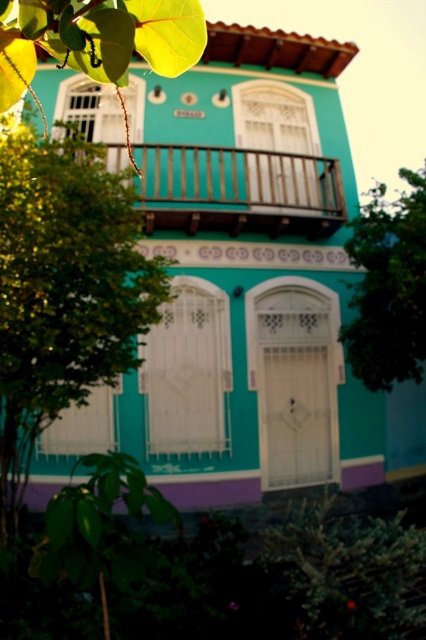
Does wooden at upper center have a larger size compared to green leafy tree at upper right?

Correct, wooden at upper center is larger in size than green leafy tree at upper right.

Does point (252, 166) come farther from viewer compared to point (354, 317)?

Yes, point (252, 166) is behind point (354, 317).

Between point (328, 225) and point (420, 211), which one is positioned in front?

Point (420, 211) is in front.

Where is `wooden at upper center`? The height and width of the screenshot is (640, 426). wooden at upper center is located at coordinates (238, 189).

Is green leafy tree at left closer to camera compared to green leafy tree at lower left?

No, it is not.

Can you confirm if green leafy tree at left is positioned to the left of green leafy tree at lower left?

Correct, you'll find green leafy tree at left to the left of green leafy tree at lower left.

Is point (20, 406) behind point (124, 477)?

That is False.

Locate an element on the screen. green leafy tree at left is located at coordinates (63, 291).

Looking at this image, which is more to the left, green leafy tree at upper right or green leafy tree at lower left?

Positioned to the left is green leafy tree at lower left.

Consider the image. Does green leafy tree at upper right have a larger size compared to green leafy tree at lower left?

Yes.

Who is more distant from viewer, (391, 305) or (143, 483)?

The point (391, 305) is more distant.

The width and height of the screenshot is (426, 640). In order to click on green leafy tree at upper right in this screenshot , I will do pyautogui.click(x=388, y=285).